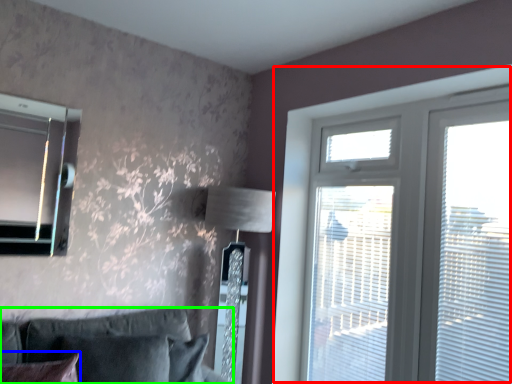
Question: Estimate the real-world distances between objects in this image. Which object is closer to window (highlighted by a red box), pillow (highlighted by a blue box) or studio couch (highlighted by a green box)?

Choices:
 (A) pillow
 (B) studio couch

Answer: (B)